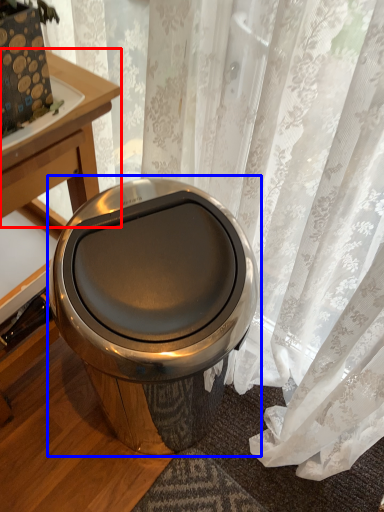
Question: Which of the following is the closest to the observer, round table (highlighted by a red box) or toilet (highlighted by a blue box)?

Choices:
 (A) round table
 (B) toilet

Answer: (B)